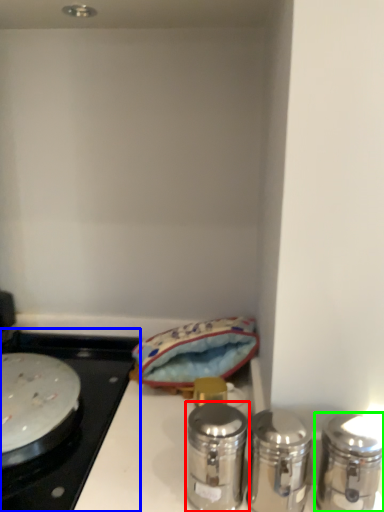
Question: Estimate the real-world distances between objects in this image. Which object is closer to salt and pepper shakers (highlighted by a red box), gas stove (highlighted by a blue box) or salt and pepper shakers (highlighted by a green box)?

Choices:
 (A) gas stove
 (B) salt and pepper shakers

Answer: (B)